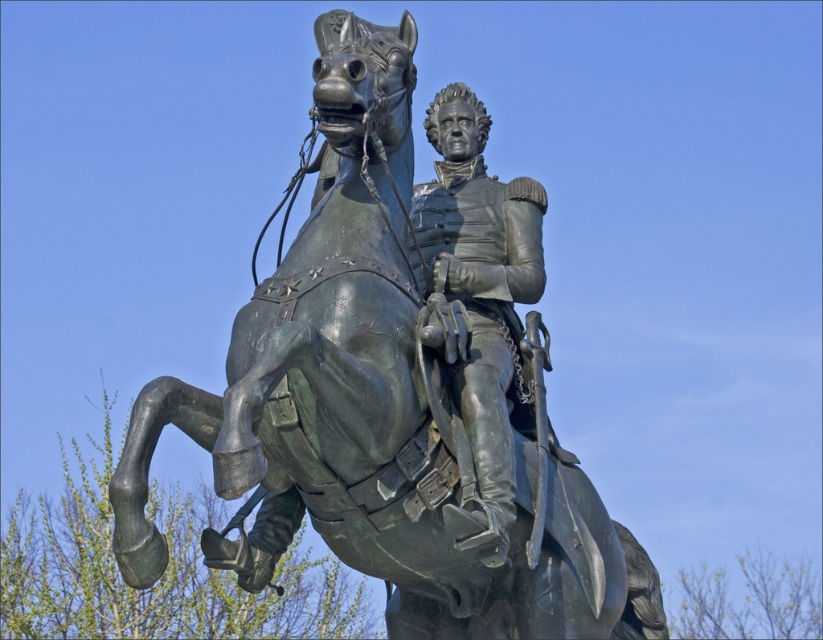
Question: Which point is closer to the camera?

Choices:
 (A) click(x=417, y=212)
 (B) click(x=523, y=422)

Answer: (B)

Question: Is bronze statue at center thinner than shiny bronze uniform at center?

Choices:
 (A) yes
 (B) no

Answer: (B)

Question: Does bronze statue at center come behind shiny bronze uniform at center?

Choices:
 (A) yes
 (B) no

Answer: (B)

Question: Can you confirm if bronze statue at center is bigger than shiny bronze uniform at center?

Choices:
 (A) yes
 (B) no

Answer: (A)